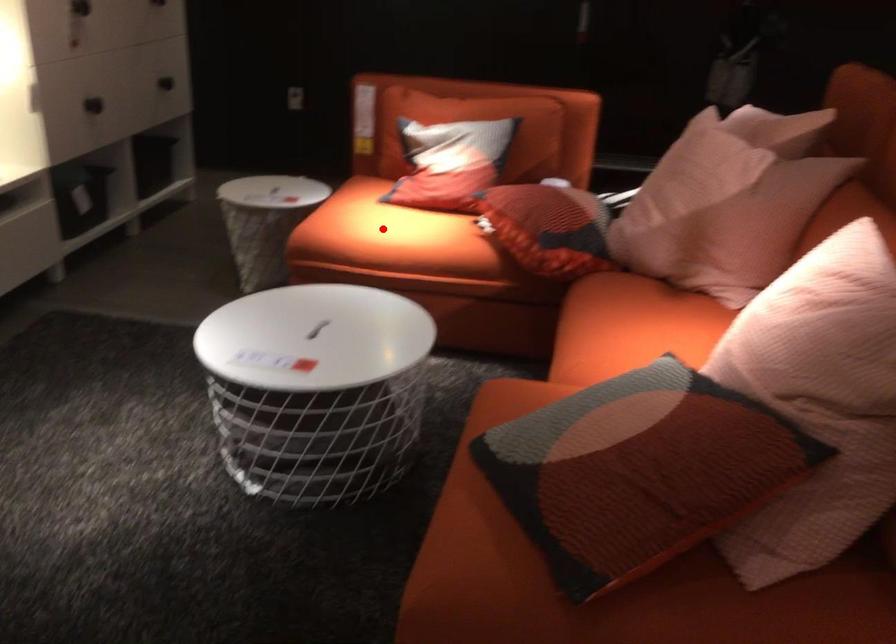
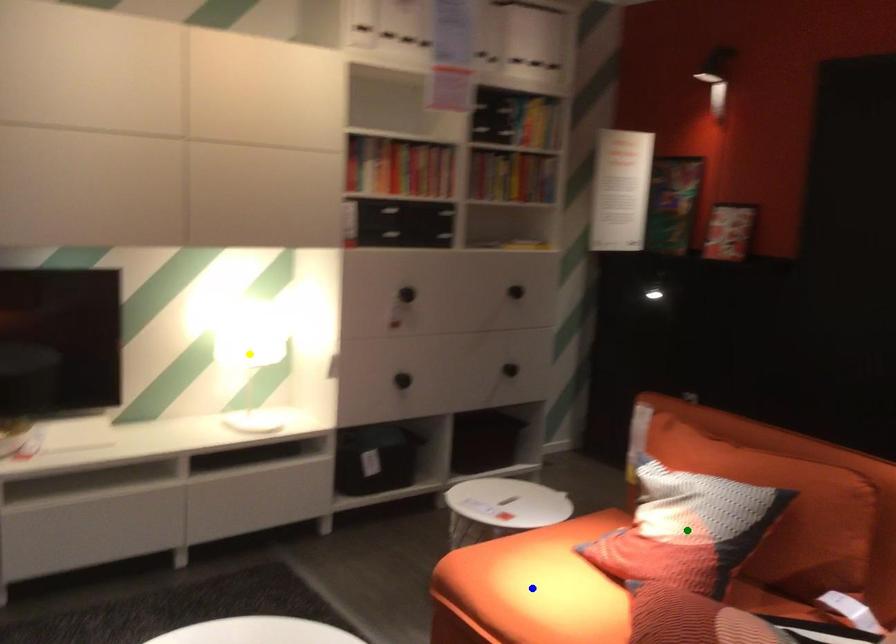
Question: I am providing you with two images of the same scene from different viewpoints. A red point is marked on the first image. You are given multiple points on the second image. Which point in image 2 is actually the same real-world point as the red point in image 1?

Choices:
 (A) green point
 (B) blue point
 (C) yellow point

Answer: (B)